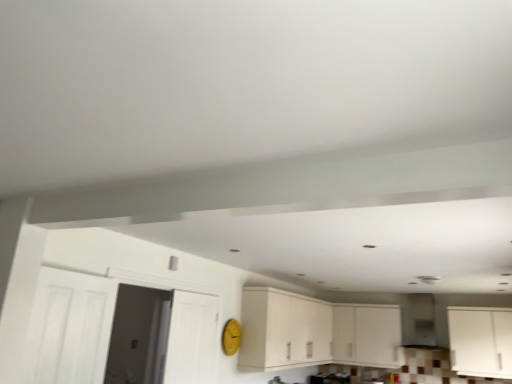
Locate an element on the screen. The width and height of the screenshot is (512, 384). matte white cabinets at center, acting as the 1th cabinetry starting from the left is located at coordinates (315, 332).

What is the approximate width of white matte cabinet at right, the 1th cabinetry positioned from the right?

white matte cabinet at right, the 1th cabinetry positioned from the right, is 13.12 inches in width.

What do you see at coordinates (481, 341) in the screenshot? Image resolution: width=512 pixels, height=384 pixels. I see `white matte cabinet at right, the 1th cabinetry positioned from the right` at bounding box center [481, 341].

Measure the distance between point (105, 327) and camera.

They are 9.08 feet apart.

Locate an element on the screen. The height and width of the screenshot is (384, 512). white matte cabinet at center, acting as the second cabinetry starting from the right is located at coordinates (367, 335).

Is white wooden door at left, which is counted as the second door, starting from the back, looking in the opposite direction of white matte door at left, the 3th door from the back?

No, white wooden door at left, which is counted as the second door, starting from the back, is not facing the opposite direction of white matte door at left, the 3th door from the back.

From the image's perspective, which object appears higher, white wooden door at left, which is counted as the second door, starting from the back, or white matte door at left, the 3th door from the back?

white matte door at left, the 3th door from the back.

From a real-world perspective, who is located higher, white wooden door at left, the second door viewed from the front, or white matte door at left, the 3th door from the back?

white matte door at left, the 3th door from the back, from a real-world perspective.

Identify the location of door that is the 1st one below the white matte door at left, the 3th door from the back (from a real-world perspective). This screenshot has height=384, width=512. (119, 332).

Considering the sizes of white matte cabinet at center, positioned as the second cabinetry in left-to-right order, and white matte door at left, the first door in the front-to-back sequence, in the image, is white matte cabinet at center, positioned as the second cabinetry in left-to-right order, wider or thinner than white matte door at left, the first door in the front-to-back sequence,?

Clearly, white matte cabinet at center, positioned as the second cabinetry in left-to-right order, has more width compared to white matte door at left, the first door in the front-to-back sequence.

From the image's perspective, which is above, white matte cabinet at center, positioned as the second cabinetry in left-to-right order, or white matte door at left, the 3th door from the back?

white matte door at left, the 3th door from the back, from the image's perspective.

Considering the points (382, 351) and (33, 332), which point is behind, point (382, 351) or point (33, 332)?

The point (382, 351) is farther.

Which of these two, white matte door at left, the 3th door from the back, or white wooden door at left, which is counted as the second door, starting from the back, is bigger?

With larger size is white wooden door at left, which is counted as the second door, starting from the back.

From a real-world perspective, is white matte door at left, the first door in the front-to-back sequence, physically below white wooden door at left, the second door viewed from the front?

Incorrect, from a real-world perspective, white matte door at left, the first door in the front-to-back sequence, is higher than white wooden door at left, the second door viewed from the front.

Measure the distance between white matte door at left, the first door in the front-to-back sequence, and white wooden door at left, which is counted as the second door, starting from the back.

white matte door at left, the first door in the front-to-back sequence, and white wooden door at left, which is counted as the second door, starting from the back, are 5.25 inches apart.

Can you confirm if white matte door at left, the 3th door from the back, is shorter than white wooden door at left, which is counted as the second door, starting from the back?

Indeed, white matte door at left, the 3th door from the back, has a lesser height compared to white wooden door at left, which is counted as the second door, starting from the back.

From a real-world perspective, is white matte door at left, the first door in the front-to-back sequence, physically below matte white cabinets at center, acting as the 1th cabinetry starting from the left?

Correct, in the physical world, white matte door at left, the first door in the front-to-back sequence, is lower than matte white cabinets at center, acting as the 1th cabinetry starting from the left.

Between white matte door at left, the 3th door from the back, and matte white cabinets at center, acting as the 1th cabinetry starting from the left, which one has smaller size?

white matte door at left, the 3th door from the back, is smaller.

The width and height of the screenshot is (512, 384). I want to click on the 1st cabinetry behind the white matte door at left, the 3th door from the back, starting your count from the anchor, so click(315, 332).

Relative to matte white cabinets at center, acting as the 1th cabinetry starting from the left, is white matte cabinet at right, the 1th cabinetry positioned from the right, in front or behind?

In the image, white matte cabinet at right, the 1th cabinetry positioned from the right, appears behind matte white cabinets at center, acting as the 1th cabinetry starting from the left.

Is white matte cabinet at right, the 1th cabinetry positioned from the right, far from matte white cabinets at center, acting as the third cabinetry starting from the right?

Absolutely, white matte cabinet at right, the 1th cabinetry positioned from the right, is distant from matte white cabinets at center, acting as the third cabinetry starting from the right.

From a real-world perspective, is white matte cabinet at right, acting as the third cabinetry starting from the left, under matte white cabinets at center, acting as the third cabinetry starting from the right?

Yes.

From the image's perspective, is white matte cabinet at right, the 1th cabinetry positioned from the right, located beneath matte white cabinets at center, acting as the 1th cabinetry starting from the left?

Yes, from the image's perspective, white matte cabinet at right, the 1th cabinetry positioned from the right, is below matte white cabinets at center, acting as the 1th cabinetry starting from the left.

Which is behind, white matte door at left, the 3th door from the back, or white matte cabinet at center, positioned as the second cabinetry in left-to-right order?

white matte cabinet at center, positioned as the second cabinetry in left-to-right order.

From the image's perspective, which object appears higher, white matte door at left, the 3th door from the back, or white matte cabinet at center, positioned as the second cabinetry in left-to-right order?

white matte door at left, the 3th door from the back, from the image's perspective.

Between point (106, 285) and point (362, 306), which one is positioned behind?

Positioned behind is point (362, 306).

Is white matte door at left, the 3th door from the back, not near white matte cabinet at center, positioned as the second cabinetry in left-to-right order?

Yes, white matte door at left, the 3th door from the back, and white matte cabinet at center, positioned as the second cabinetry in left-to-right order, are quite far apart.

Is matte white cabinets at center, acting as the third cabinetry starting from the right, facing towards white matte door at left, the first door in the front-to-back sequence?

No, matte white cabinets at center, acting as the third cabinetry starting from the right, is not aimed at white matte door at left, the first door in the front-to-back sequence.

You are a GUI agent. You are given a task and a screenshot of the screen. Output one action in this format:
    pyautogui.click(x=<x>, y=<y>)
    Task: Click on the 1st cabinetry below when counting from the white matte door at left, the 3th door from the back (from the image's perspective)
    This screenshot has width=512, height=384.
    Given the screenshot: What is the action you would take?
    pyautogui.click(x=315, y=332)

Between matte white cabinets at center, acting as the third cabinetry starting from the right, and white matte door at left, the first door in the front-to-back sequence, which one has larger width?

Wider between the two is matte white cabinets at center, acting as the third cabinetry starting from the right.

This screenshot has height=384, width=512. Identify the location of door located in front of the white wooden door at left, which is counted as the second door, starting from the back. (70, 327).

Which cabinetry is the 2nd one when counting from the right side of the white matte door at left, the 3th door from the back? Please provide its 2D coordinates.

[(367, 335)]

From the image, which object appears to be nearer to white matte cabinet at right, acting as the third cabinetry starting from the left, white matte cabinet at center, acting as the second cabinetry starting from the right, or matte white cabinets at center, acting as the 1th cabinetry starting from the left?

white matte cabinet at center, acting as the second cabinetry starting from the right.

Based on their spatial positions, is white wooden door at left, the second door viewed from the front, or white matte cabinet at center, positioned as the second cabinetry in left-to-right order, closer to matte white cabinets at center, acting as the 1th cabinetry starting from the left?

The object closer to matte white cabinets at center, acting as the 1th cabinetry starting from the left, is white matte cabinet at center, positioned as the second cabinetry in left-to-right order.

Looking at the image, which one is located further to white matte cabinet at center, positioned as the second cabinetry in left-to-right order, white matte door at left, which is the first door from back to front, or white wooden door at left, which is counted as the second door, starting from the back?

white wooden door at left, which is counted as the second door, starting from the back, is positioned further to the anchor white matte cabinet at center, positioned as the second cabinetry in left-to-right order.

Estimate the real-world distances between objects in this image. Which object is further from white matte cabinet at right, acting as the third cabinetry starting from the left, white matte door at left, the 3th door from the back, or matte white cabinets at center, acting as the 1th cabinetry starting from the left?

white matte door at left, the 3th door from the back.

Looking at the image, which one is located closer to white matte door at left, the 3th door from the back, white matte cabinet at right, the 1th cabinetry positioned from the right, or white matte cabinet at center, positioned as the second cabinetry in left-to-right order?

white matte cabinet at center, positioned as the second cabinetry in left-to-right order, is positioned closer to the anchor white matte door at left, the 3th door from the back.

Considering their positions, is white matte cabinet at center, positioned as the second cabinetry in left-to-right order, positioned further to white matte door at left, which is the first door from back to front, than white wooden door at left, the second door viewed from the front?

Among the two, white matte cabinet at center, positioned as the second cabinetry in left-to-right order, is located further to white matte door at left, which is the first door from back to front.

Based on the photo, based on their spatial positions, is white wooden door at left, which is counted as the second door, starting from the back, or white matte door at left, the first door in the front-to-back sequence, closer to white matte cabinet at center, positioned as the second cabinetry in left-to-right order?

white wooden door at left, which is counted as the second door, starting from the back, is closer to white matte cabinet at center, positioned as the second cabinetry in left-to-right order.

From the image, which object appears to be farther from white wooden door at left, the second door viewed from the front, white matte door at left, placed as the 3th door when sorted from front to back, or white matte cabinet at right, the 1th cabinetry positioned from the right?

white matte cabinet at right, the 1th cabinetry positioned from the right, is further to white wooden door at left, the second door viewed from the front.

Locate an element on the screen. This screenshot has height=384, width=512. cabinetry between matte white cabinets at center, acting as the third cabinetry starting from the right, and white matte cabinet at right, acting as the third cabinetry starting from the left, in the horizontal direction is located at coordinates (367, 335).

Locate an element on the screen. door between white wooden door at left, which is counted as the second door, starting from the back, and white matte cabinet at right, the 1th cabinetry positioned from the right is located at coordinates (192, 339).

At what (x,y) coordinates should I click in order to perform the action: click on door between white wooden door at left, the second door viewed from the front, and white matte cabinet at center, acting as the second cabinetry starting from the right, from front to back. Please return your answer as a coordinate pair (x, y). Image resolution: width=512 pixels, height=384 pixels. Looking at the image, I should click on (192, 339).

Identify the location of door between white matte door at left, the 3th door from the back, and white matte door at left, which is the first door from back to front, in the front-back direction. The width and height of the screenshot is (512, 384). (119, 332).